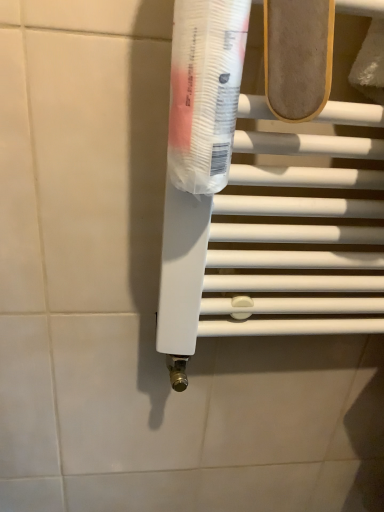
Question: From the image's perspective, is light brown suede shoe at upper center located above or below transparent plastic tube at center?

Choices:
 (A) above
 (B) below

Answer: (A)

Question: Based on their sizes in the image, would you say light brown suede shoe at upper center is bigger or smaller than transparent plastic tube at center?

Choices:
 (A) small
 (B) big

Answer: (A)

Question: Which is nearer to the transparent plastic tube at center?

Choices:
 (A) light brown suede shoe at upper center
 (B) white plastic towel bar at center

Answer: (A)

Question: Which is nearer to the white plastic towel bar at center?

Choices:
 (A) light brown suede shoe at upper center
 (B) transparent plastic tube at center

Answer: (B)